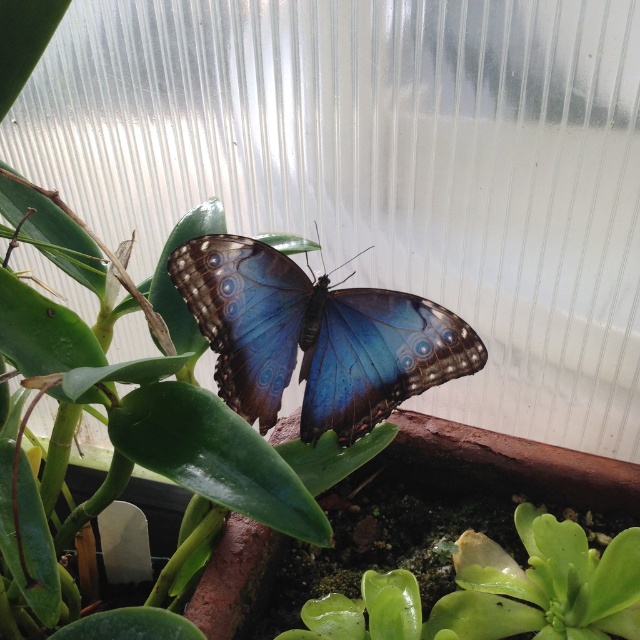
Question: In this image, where is shiny blue butterfly at center located relative to glossy green succulent at bottom right?

Choices:
 (A) left
 (B) right

Answer: (A)

Question: Can you confirm if shiny blue butterfly at center is positioned to the left of glossy green succulent at bottom right?

Choices:
 (A) yes
 (B) no

Answer: (A)

Question: Does shiny blue butterfly at center appear on the left side of glossy green succulent at bottom right?

Choices:
 (A) yes
 (B) no

Answer: (A)